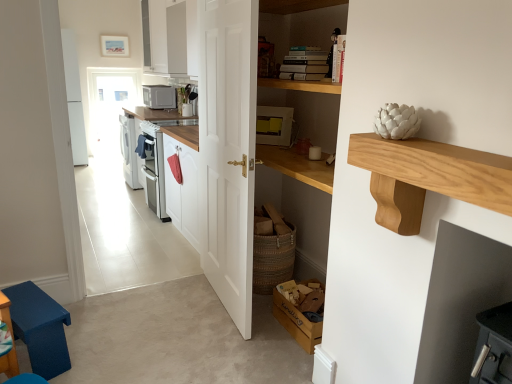
I want to click on unoccupied area in front of white wooden door at center, so click(211, 343).